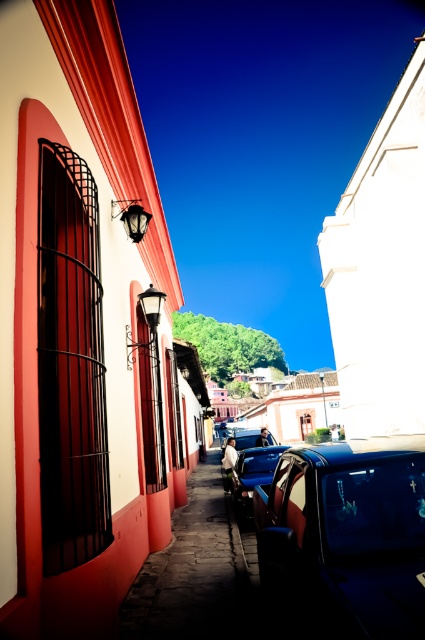
Question: Does shiny blue car at center have a smaller size compared to metallic blue car at center?

Choices:
 (A) no
 (B) yes

Answer: (A)

Question: Does shiny blue car at center appear on the right side of glossy blue car at center?

Choices:
 (A) no
 (B) yes

Answer: (A)

Question: Which object is closer to the camera taking this photo?

Choices:
 (A) shiny blue car at center
 (B) glossy blue car at center
 (C) metallic blue car at center
 (D) shiny blue car at right

Answer: (D)

Question: Is shiny blue car at center below metallic blue car at center?

Choices:
 (A) yes
 (B) no

Answer: (A)

Question: Which of the following is the closest to the observer?

Choices:
 (A) metallic blue car at center
 (B) glossy blue car at center
 (C) shiny blue car at right
 (D) shiny blue car at center

Answer: (C)

Question: Among these points, which one is farthest from the camera?

Choices:
 (A) (155, 588)
 (B) (240, 477)
 (C) (252, 428)

Answer: (C)